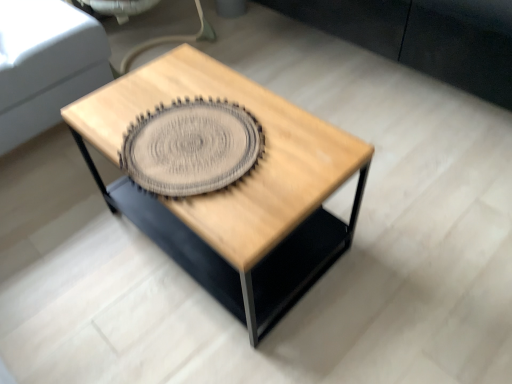
The width and height of the screenshot is (512, 384). What do you see at coordinates (252, 172) in the screenshot?
I see `natural wood coffee table at center` at bounding box center [252, 172].

Locate an element on the screen. This screenshot has height=384, width=512. natural wood coffee table at center is located at coordinates (252, 172).

Find the location of a particular element. natural wood coffee table at center is located at coordinates (252, 172).